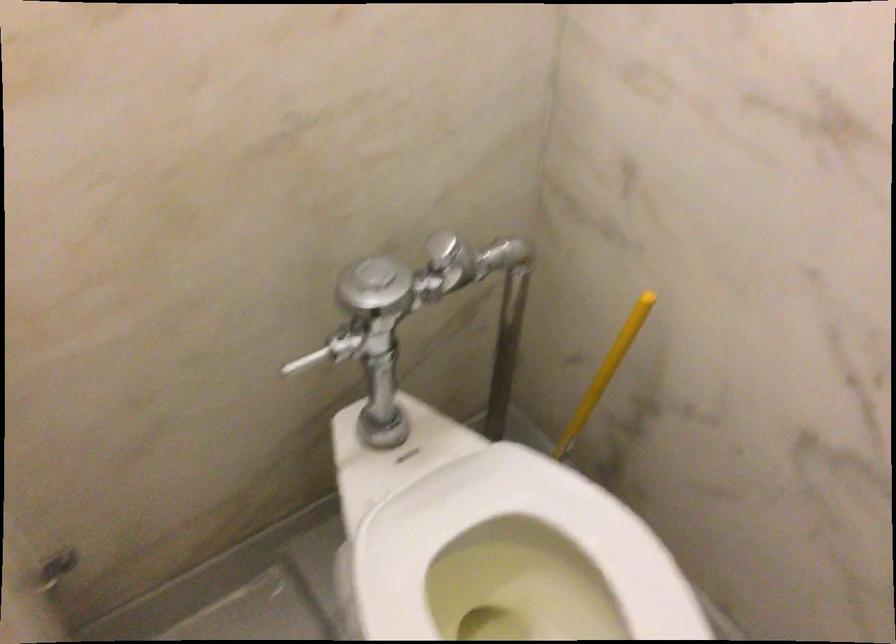
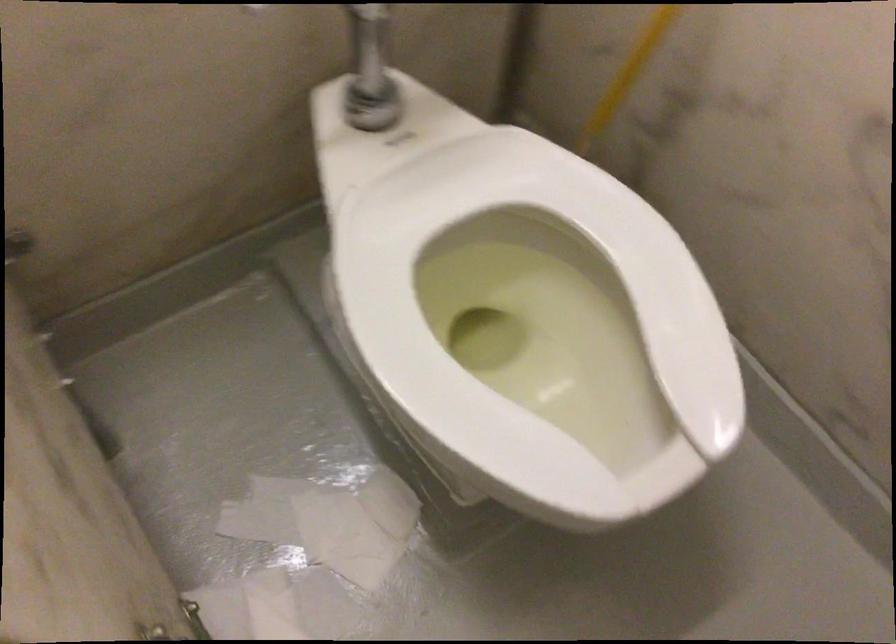
Find the pixel in the second image that matches (535,554) in the first image.

(536, 254)